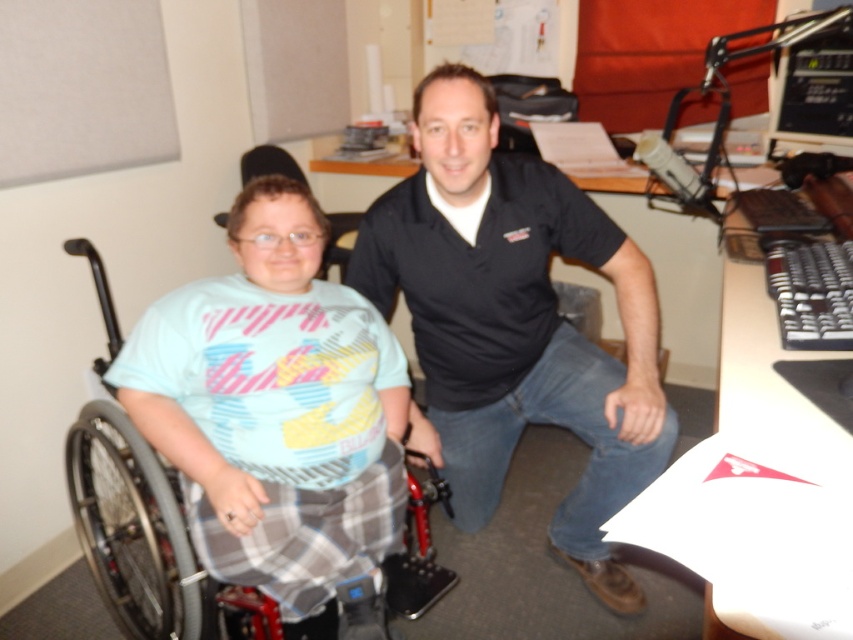
Question: Which of the following is the closest to the observer?

Choices:
 (A) (109, 307)
 (B) (351, 284)
 (C) (804, 124)

Answer: (B)

Question: Which point is farther from the camera taking this photo?

Choices:
 (A) (248, 630)
 (B) (581, 234)

Answer: (B)

Question: Among these points, which one is farthest from the camera?

Choices:
 (A) (840, 92)
 (B) (312, 625)
 (C) (550, 528)

Answer: (A)

Question: Can you confirm if black cotton shirt at center is wider than black plastic monitor at upper right?

Choices:
 (A) no
 (B) yes

Answer: (B)

Question: Can you confirm if metallic gray wheelchair at left is wider than black plastic monitor at upper right?

Choices:
 (A) no
 (B) yes

Answer: (B)

Question: Is black cotton shirt at center above black plastic monitor at upper right?

Choices:
 (A) no
 (B) yes

Answer: (A)